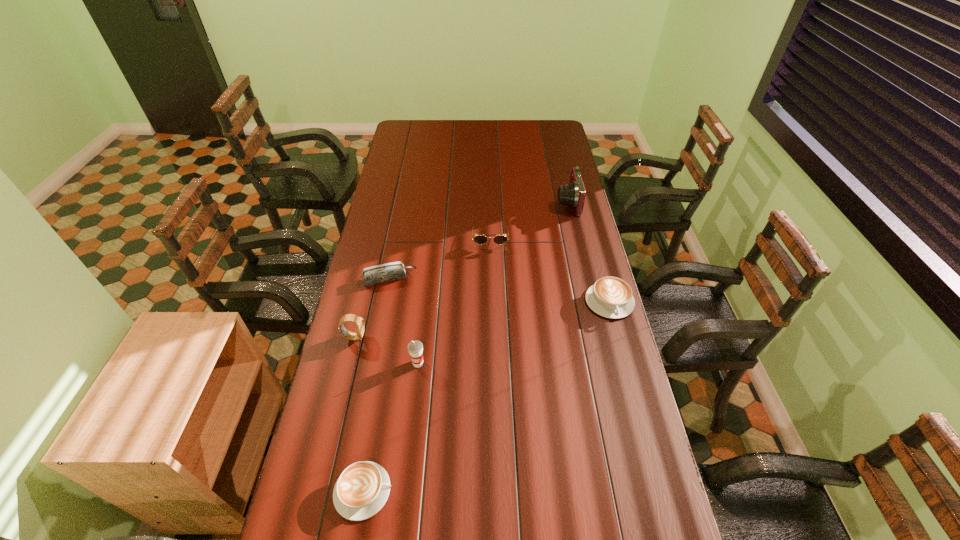
If equal spacing is desired by inserting an extra cappuccino among them, please point out a free spot for this new cappuccino. Please provide its 2D coordinates. Your answer should be formatted as a tuple, i.e. [(x, y)], where the tuple contains the x and y coordinates of a point satisfying the conditions above.

[(507, 381)]